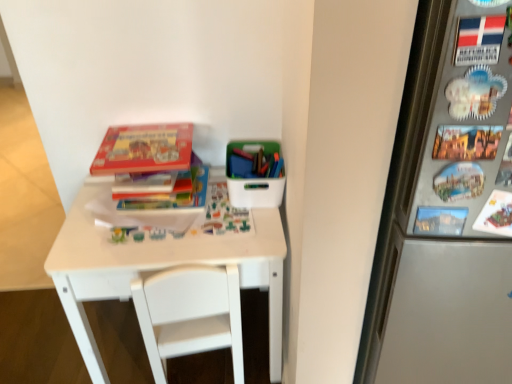
Identify the location of vacant area that is in front of hardcover book at center, which ranks as the first book in bottom-to-top order. (151, 248).